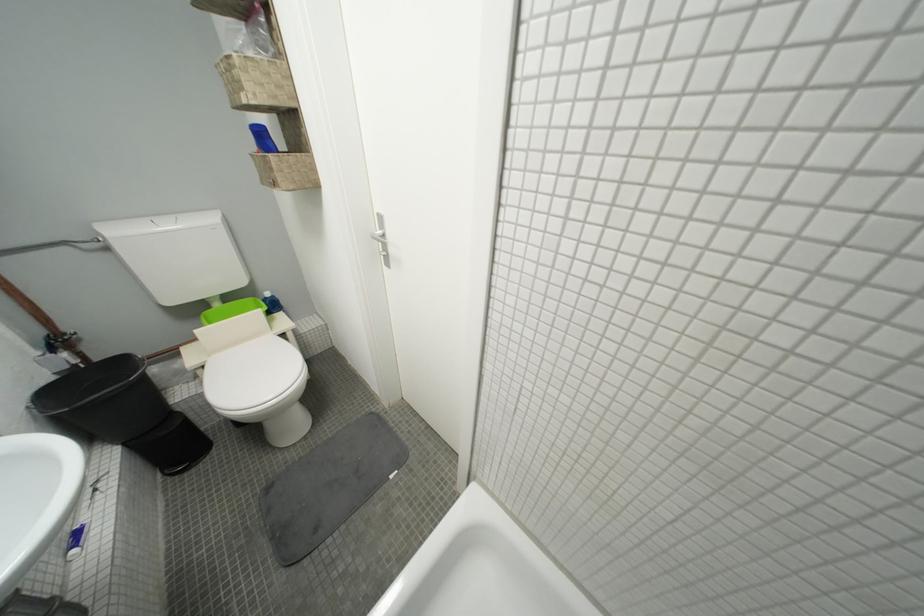
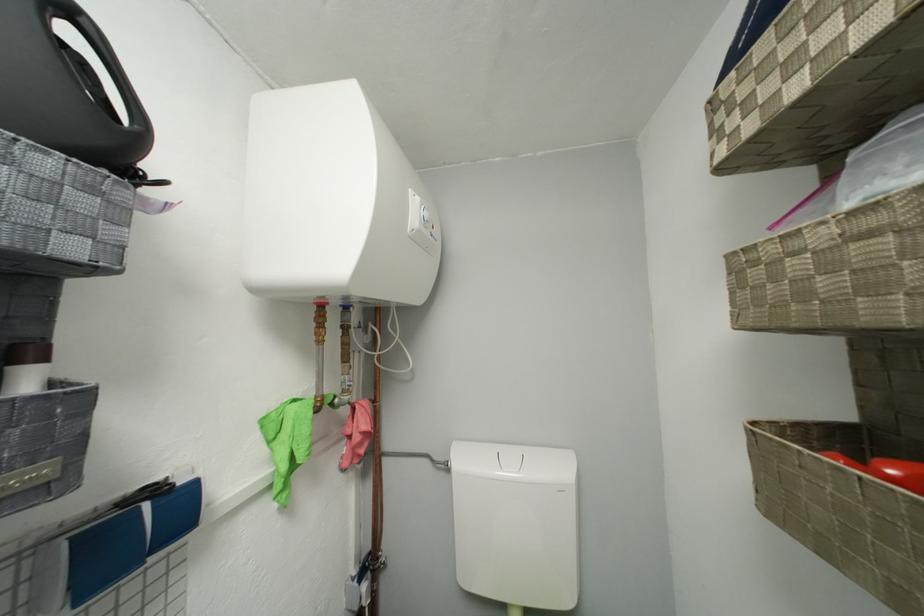
Based on the continuous images, in which direction is the camera rotating?

The camera rotated toward left-up.